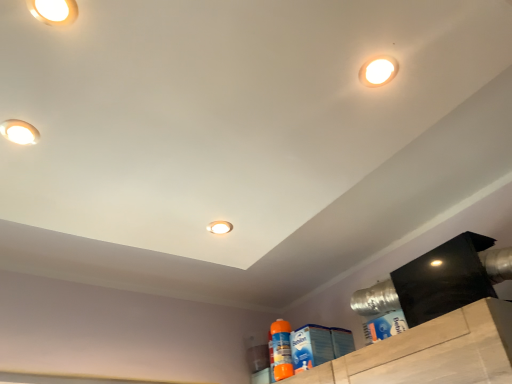
Question: Is matte white droplight at upper left, marked as the 4th droplight in a bottom-to-top arrangement, to the left of blue cardboard box at lower right, the first cleaning product viewed from the front, from the viewer's perspective?

Choices:
 (A) no
 (B) yes

Answer: (B)

Question: Could blue cardboard box at lower right, placed as the 2th cleaning product when sorted from bottom to top, be considered to be inside matte white droplight at upper left, marked as the 1th droplight in a front-to-back arrangement?

Choices:
 (A) no
 (B) yes

Answer: (A)

Question: Is the depth of matte white droplight at upper left, placed as the third droplight when sorted from right to left, less than that of blue cardboard box at lower right, which is the 1th cleaning product from right to left?

Choices:
 (A) yes
 (B) no

Answer: (A)

Question: Considering the relative sizes of matte white droplight at upper left, marked as the 1th droplight in a front-to-back arrangement, and blue cardboard box at lower right, positioned as the 2th cleaning product in back-to-front order, in the image provided, is matte white droplight at upper left, marked as the 1th droplight in a front-to-back arrangement, thinner than blue cardboard box at lower right, positioned as the 2th cleaning product in back-to-front order,?

Choices:
 (A) no
 (B) yes

Answer: (A)

Question: Does matte white droplight at upper left, which is counted as the fourth droplight, starting from the back, come behind blue cardboard box at lower right, the first cleaning product from the top?

Choices:
 (A) no
 (B) yes

Answer: (A)

Question: From a real-world perspective, does matte white droplight at upper left, the 2th droplight positioned from the left, sit lower than blue cardboard box at lower right, the first cleaning product from the top?

Choices:
 (A) yes
 (B) no

Answer: (B)

Question: Could you tell me if white glossy droplight at upper right, which appears as the 1th droplight when viewed from the right, is facing blue cardboard box at lower right, the first cleaning product viewed from the front?

Choices:
 (A) yes
 (B) no

Answer: (B)

Question: From the image's perspective, is white glossy droplight at upper right, arranged as the fourth droplight when viewed from the left, under blue cardboard box at lower right, placed as the 2th cleaning product when sorted from bottom to top?

Choices:
 (A) yes
 (B) no

Answer: (B)

Question: Is blue cardboard box at lower right, the first cleaning product viewed from the front, at the back of white glossy droplight at upper right, arranged as the third droplight when ordered from the bottom?

Choices:
 (A) yes
 (B) no

Answer: (B)

Question: Is white glossy droplight at upper right, arranged as the fourth droplight when viewed from the left, surrounding blue cardboard box at lower right, which is counted as the second cleaning product, starting from the left?

Choices:
 (A) no
 (B) yes

Answer: (A)

Question: Is white glossy droplight at upper right, which is counted as the second droplight, starting from the front, outside blue cardboard box at lower right, placed as the 2th cleaning product when sorted from bottom to top?

Choices:
 (A) yes
 (B) no

Answer: (A)

Question: Is white glossy droplight at upper right, arranged as the third droplight when ordered from the bottom, taller than blue cardboard box at lower right, positioned as the 2th cleaning product in back-to-front order?

Choices:
 (A) no
 (B) yes

Answer: (A)

Question: From a real-world perspective, is matte white droplight at upper left, marked as the 1th droplight in a front-to-back arrangement, beneath orange plastic spray bottle at lower right, which is the 1th cleaning product in bottom-to-top order?

Choices:
 (A) yes
 (B) no

Answer: (B)